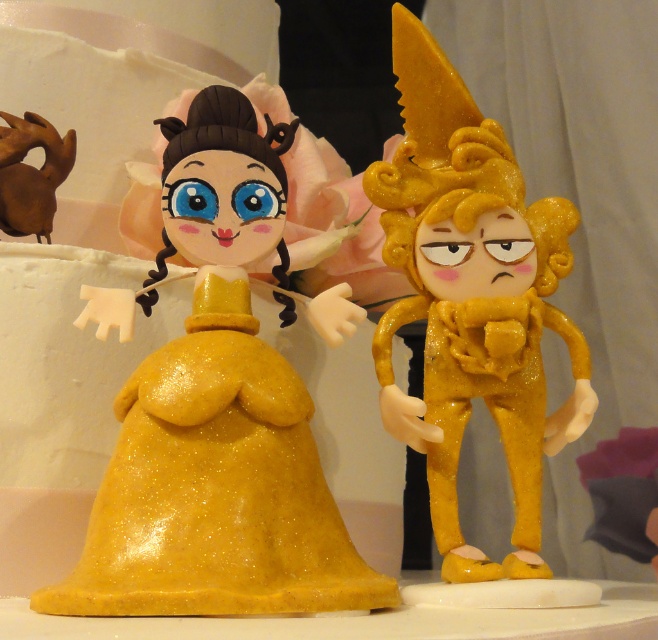
Between glittery gold dress at center and glittery gold figure at right, which one has more height?

With more height is glittery gold figure at right.

Describe the element at coordinates (218, 412) in the screenshot. I see `glittery gold dress at center` at that location.

You are a GUI agent. You are given a task and a screenshot of the screen. Output one action in this format:
    pyautogui.click(x=<x>, y=<y>)
    Task: Click on the glittery gold dress at center
    The height and width of the screenshot is (640, 658).
    Given the screenshot: What is the action you would take?
    pyautogui.click(x=218, y=412)